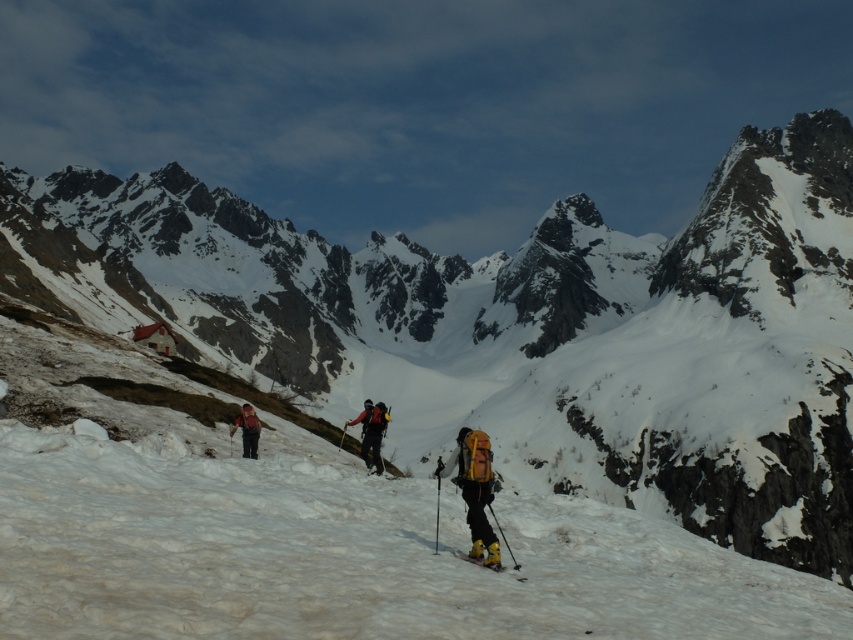
Question: Which point is closer to the camera?

Choices:
 (A) (469, 442)
 (B) (479, 564)
 (C) (253, 429)

Answer: (B)

Question: Does matte red backpack at center have a lesser width compared to yellow matte ski at lower center?

Choices:
 (A) yes
 (B) no

Answer: (B)

Question: Considering the real-world distances, which object is closest to the matte black backpack at center?

Choices:
 (A) yellow matte ski at lower center
 (B) yellow fabric backpack at center
 (C) matte red backpack at center

Answer: (C)

Question: Among these points, which one is nearest to the camera?

Choices:
 (A) pos(473,557)
 (B) pos(375,435)
 (C) pos(242,417)
 (D) pos(480,513)

Answer: (A)

Question: Is yellow fabric backpack at center closer to the viewer compared to yellow matte ski at lower center?

Choices:
 (A) no
 (B) yes

Answer: (B)

Question: Is yellow fabric backpack at center below matte red backpack at center?

Choices:
 (A) yes
 (B) no

Answer: (A)